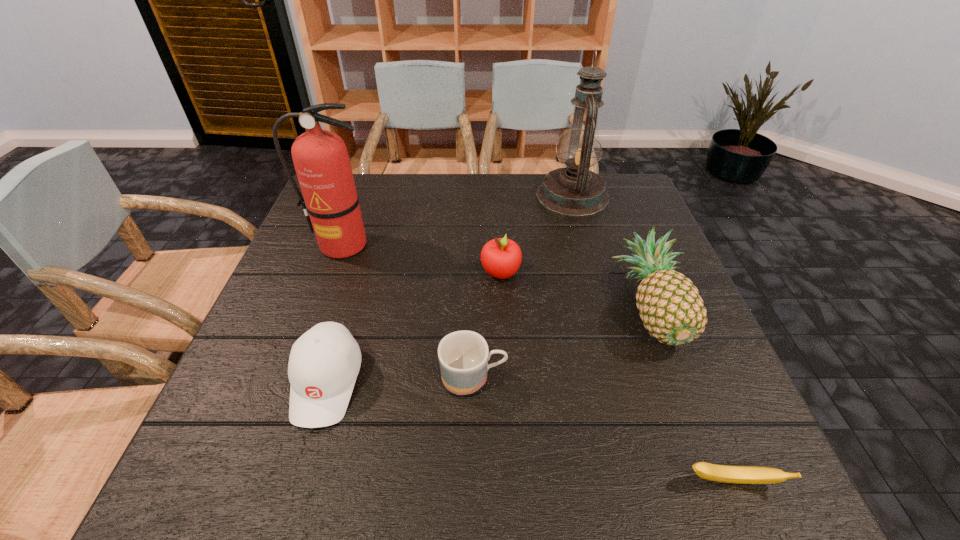
Where is `vacant space that's between the banana and the baseball cap`? vacant space that's between the banana and the baseball cap is located at coordinates (530, 432).

You are a GUI agent. You are given a task and a screenshot of the screen. Output one action in this format:
    pyautogui.click(x=<x>, y=<y>)
    Task: Click on the free space between the oil lamp and the apple
    
    Given the screenshot: What is the action you would take?
    pyautogui.click(x=537, y=234)

Locate an element on the screen. The height and width of the screenshot is (540, 960). vacant area that lies between the mug and the fire extinguisher is located at coordinates (408, 312).

The image size is (960, 540). Find the location of `vacant point located between the baseball cap and the mug`. vacant point located between the baseball cap and the mug is located at coordinates (400, 380).

Find the location of a particular element. This screenshot has width=960, height=540. empty location between the banana and the farthest object is located at coordinates (653, 339).

The height and width of the screenshot is (540, 960). I want to click on vacant region between the oil lamp and the apple, so click(537, 234).

The width and height of the screenshot is (960, 540). What are the coordinates of `empty space between the farthest object and the nearest object` in the screenshot? It's located at (653, 339).

What are the coordinates of `vacant area that lies between the apple and the banana` in the screenshot? It's located at coord(616,377).

Locate which object ranks second in proximity to the nearest object. Please provide its 2D coordinates. Your answer should be formatted as a tuple, i.e. [(x, y)], where the tuple contains the x and y coordinates of a point satisfying the conditions above.

[(463, 356)]

Locate an element on the screen. object that ranks as the second closest to the apple is located at coordinates (670, 306).